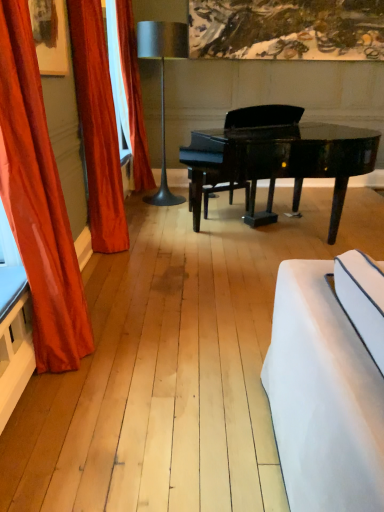
The image size is (384, 512). Identify the location of satin orange curtain at left, which is the third curtain in back-to-front order. (38, 201).

This screenshot has height=512, width=384. Identify the location of orange velvet curtain at left, the 3th curtain in the front-to-back sequence. point(133,96).

What are the coordinates of `metallic gray floor lamp at center` in the screenshot? It's located at 162,83.

What is the approximate height of velvet orange curtain at left, the second curtain when ordered from back to front?

velvet orange curtain at left, the second curtain when ordered from back to front, is 6.08 feet in height.

How much space does velvet orange curtain at left, which ranks as the 2th curtain in front-to-back order, occupy horizontally?

velvet orange curtain at left, which ranks as the 2th curtain in front-to-back order, is 33.35 centimeters in width.

This screenshot has width=384, height=512. What are the coordinates of `satin orange curtain at left, which is the third curtain in back-to-front order` in the screenshot? It's located at 38,201.

In the scene shown: Is satin orange curtain at left, the 1th curtain positioned from the front, positioned with its back to glossy black piano at center?

No, satin orange curtain at left, the 1th curtain positioned from the front, is not facing the opposite direction of glossy black piano at center.

Find the location of a particular element. curtain below the glossy black piano at center (from the image's perspective) is located at coordinates [x=38, y=201].

Considering the relative positions of satin orange curtain at left, the 1th curtain positioned from the front, and glossy black piano at center in the image provided, is satin orange curtain at left, the 1th curtain positioned from the front, in front of glossy black piano at center?

Yes, satin orange curtain at left, the 1th curtain positioned from the front, is in front of glossy black piano at center.

Where is `the 1st curtain in front of the orange velvet curtain at left, the 3th curtain in the front-to-back sequence`? The width and height of the screenshot is (384, 512). the 1st curtain in front of the orange velvet curtain at left, the 3th curtain in the front-to-back sequence is located at coordinates (98, 127).

Which of these two, orange velvet curtain at left, the 3th curtain in the front-to-back sequence, or velvet orange curtain at left, the second curtain when ordered from back to front, is wider?

With larger width is orange velvet curtain at left, the 3th curtain in the front-to-back sequence.

From a real-world perspective, which is physically above, orange velvet curtain at left, the first curtain when ordered from back to front, or velvet orange curtain at left, the second curtain when ordered from back to front?

From a 3D spatial view, orange velvet curtain at left, the first curtain when ordered from back to front, is above.

Does glossy black piano at center appear on the left side of satin orange curtain at left, the 1th curtain positioned from the front?

No, glossy black piano at center is not to the left of satin orange curtain at left, the 1th curtain positioned from the front.

Image resolution: width=384 pixels, height=512 pixels. I want to click on piano behind the satin orange curtain at left, which is the third curtain in back-to-front order, so click(x=280, y=162).

Relative to satin orange curtain at left, which is the third curtain in back-to-front order, is glossy black piano at center in front or behind?

Clearly, glossy black piano at center is behind satin orange curtain at left, which is the third curtain in back-to-front order.

Between glossy black piano at center and satin orange curtain at left, which is the third curtain in back-to-front order, which one has smaller size?

With smaller size is satin orange curtain at left, which is the third curtain in back-to-front order.

Does point (123, 32) appear closer or farther from the camera than point (336, 159)?

Point (123, 32) is farther from the camera than point (336, 159).

Can you tell me how much orange velvet curtain at left, the first curtain when ordered from back to front, and glossy black piano at center differ in facing direction?

The facing directions of orange velvet curtain at left, the first curtain when ordered from back to front, and glossy black piano at center are 58 degrees apart.

Is the depth of orange velvet curtain at left, the 3th curtain in the front-to-back sequence, less than that of glossy black piano at center?

That is False.

From the image's perspective, is orange velvet curtain at left, the 3th curtain in the front-to-back sequence, on top of glossy black piano at center?

Indeed, from the image's perspective, orange velvet curtain at left, the 3th curtain in the front-to-back sequence, is shown above glossy black piano at center.

Does velvet orange curtain at left, which ranks as the 2th curtain in front-to-back order, lie in front of metallic gray floor lamp at center?

Yes, velvet orange curtain at left, which ranks as the 2th curtain in front-to-back order, is closer to the camera.

Considering the sizes of objects velvet orange curtain at left, the second curtain when ordered from back to front, and metallic gray floor lamp at center in the image provided, who is taller, velvet orange curtain at left, the second curtain when ordered from back to front, or metallic gray floor lamp at center?

velvet orange curtain at left, the second curtain when ordered from back to front, is taller.

Could you measure the distance between velvet orange curtain at left, which ranks as the 2th curtain in front-to-back order, and metallic gray floor lamp at center?

velvet orange curtain at left, which ranks as the 2th curtain in front-to-back order, is 5.39 feet away from metallic gray floor lamp at center.

Consider the image. Between velvet orange curtain at left, the second curtain when ordered from back to front, and metallic gray floor lamp at center, which one has larger size?

With larger size is metallic gray floor lamp at center.

Could you tell me if velvet orange curtain at left, the second curtain when ordered from back to front, is turned towards satin orange curtain at left, the 1th curtain positioned from the front?

No, velvet orange curtain at left, the second curtain when ordered from back to front, is not oriented towards satin orange curtain at left, the 1th curtain positioned from the front.

Can you tell me how much velvet orange curtain at left, which ranks as the 2th curtain in front-to-back order, and satin orange curtain at left, which is the third curtain in back-to-front order, differ in facing direction?

The facing directions of velvet orange curtain at left, which ranks as the 2th curtain in front-to-back order, and satin orange curtain at left, which is the third curtain in back-to-front order, are 0.365 degrees apart.

Is velvet orange curtain at left, which ranks as the 2th curtain in front-to-back order, at the left side of satin orange curtain at left, the 1th curtain positioned from the front?

Yes, velvet orange curtain at left, which ranks as the 2th curtain in front-to-back order, is to the left of satin orange curtain at left, the 1th curtain positioned from the front.

Which of these two, velvet orange curtain at left, which ranks as the 2th curtain in front-to-back order, or satin orange curtain at left, which is the third curtain in back-to-front order, is bigger?

satin orange curtain at left, which is the third curtain in back-to-front order.

From the image's perspective, between orange velvet curtain at left, the 3th curtain in the front-to-back sequence, and satin orange curtain at left, which is the third curtain in back-to-front order, which one is located above?

orange velvet curtain at left, the 3th curtain in the front-to-back sequence, appears higher in the image.

Considering the positions of objects orange velvet curtain at left, the 3th curtain in the front-to-back sequence, and satin orange curtain at left, the 1th curtain positioned from the front, in the image provided, who is more to the right, orange velvet curtain at left, the 3th curtain in the front-to-back sequence, or satin orange curtain at left, the 1th curtain positioned from the front,?

→ orange velvet curtain at left, the 3th curtain in the front-to-back sequence, is more to the right.

Does point (129, 30) lie in front of point (18, 33)?

No, (129, 30) is behind (18, 33).

Which object is closer to the camera taking this photo, orange velvet curtain at left, the 3th curtain in the front-to-back sequence, or satin orange curtain at left, the 1th curtain positioned from the front?

satin orange curtain at left, the 1th curtain positioned from the front.

Where is `piano that appears behind the satin orange curtain at left, the 1th curtain positioned from the front`? The image size is (384, 512). piano that appears behind the satin orange curtain at left, the 1th curtain positioned from the front is located at coordinates (280, 162).

There is a orange velvet curtain at left, the first curtain when ordered from back to front. Where is `the 1st curtain below it (from a real-world perspective)`? This screenshot has height=512, width=384. the 1st curtain below it (from a real-world perspective) is located at coordinates (98, 127).

Estimate the real-world distances between objects in this image. Which object is further from orange velvet curtain at left, the first curtain when ordered from back to front, glossy black piano at center or metallic gray floor lamp at center?

The object further to orange velvet curtain at left, the first curtain when ordered from back to front, is glossy black piano at center.

When comparing their distances from satin orange curtain at left, which is the third curtain in back-to-front order, does metallic gray floor lamp at center or orange velvet curtain at left, the 3th curtain in the front-to-back sequence, seem further?

Among the two, orange velvet curtain at left, the 3th curtain in the front-to-back sequence, is located further to satin orange curtain at left, which is the third curtain in back-to-front order.

From the image, which object appears to be nearer to orange velvet curtain at left, the 3th curtain in the front-to-back sequence, metallic gray floor lamp at center or velvet orange curtain at left, the second curtain when ordered from back to front?

Among the two, metallic gray floor lamp at center is located nearer to orange velvet curtain at left, the 3th curtain in the front-to-back sequence.

Estimate the real-world distances between objects in this image. Which object is further from satin orange curtain at left, which is the third curtain in back-to-front order, metallic gray floor lamp at center or velvet orange curtain at left, which ranks as the 2th curtain in front-to-back order?

Based on the image, metallic gray floor lamp at center appears to be further to satin orange curtain at left, which is the third curtain in back-to-front order.

Which object lies nearer to the anchor point velvet orange curtain at left, the second curtain when ordered from back to front, metallic gray floor lamp at center or orange velvet curtain at left, the first curtain when ordered from back to front?

The object closer to velvet orange curtain at left, the second curtain when ordered from back to front, is orange velvet curtain at left, the first curtain when ordered from back to front.

Based on their spatial positions, is glossy black piano at center or orange velvet curtain at left, the 3th curtain in the front-to-back sequence, closer to velvet orange curtain at left, which ranks as the 2th curtain in front-to-back order?

glossy black piano at center.

Estimate the real-world distances between objects in this image. Which object is further from metallic gray floor lamp at center, glossy black piano at center or velvet orange curtain at left, the second curtain when ordered from back to front?

velvet orange curtain at left, the second curtain when ordered from back to front, lies further to metallic gray floor lamp at center than the other object.

Estimate the real-world distances between objects in this image. Which object is further from metallic gray floor lamp at center, satin orange curtain at left, the 1th curtain positioned from the front, or velvet orange curtain at left, which ranks as the 2th curtain in front-to-back order?

satin orange curtain at left, the 1th curtain positioned from the front.

Locate an element on the screen. lamp between satin orange curtain at left, which is the third curtain in back-to-front order, and orange velvet curtain at left, the first curtain when ordered from back to front, from front to back is located at coordinates (162, 83).

This screenshot has height=512, width=384. What are the coordinates of `curtain located between satin orange curtain at left, the 1th curtain positioned from the front, and metallic gray floor lamp at center in the depth direction` in the screenshot? It's located at (98, 127).

Where is `curtain positioned between glossy black piano at center and metallic gray floor lamp at center from near to far`? curtain positioned between glossy black piano at center and metallic gray floor lamp at center from near to far is located at coordinates (98, 127).

Locate an element on the screen. The image size is (384, 512). piano between satin orange curtain at left, the 1th curtain positioned from the front, and orange velvet curtain at left, the first curtain when ordered from back to front, in the front-back direction is located at coordinates (280, 162).